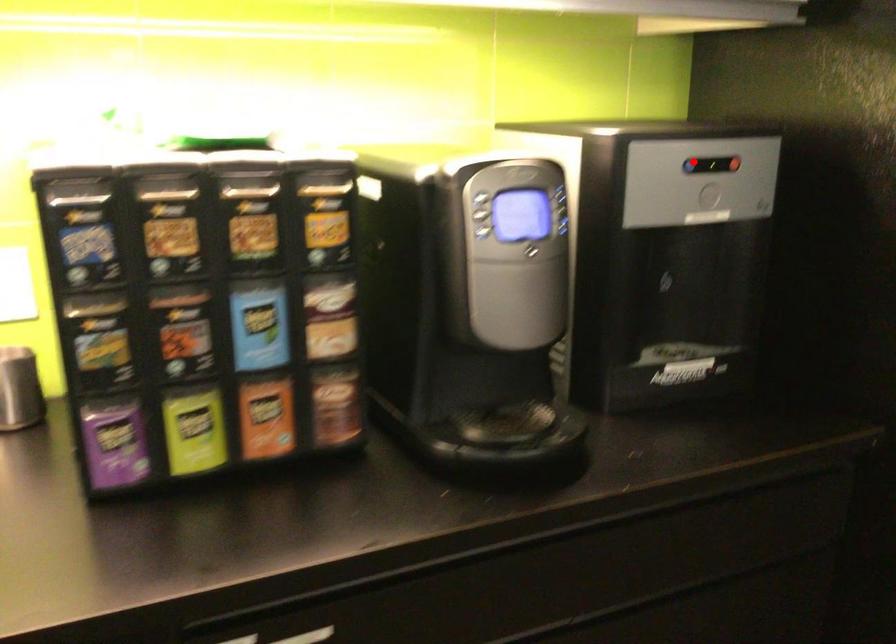
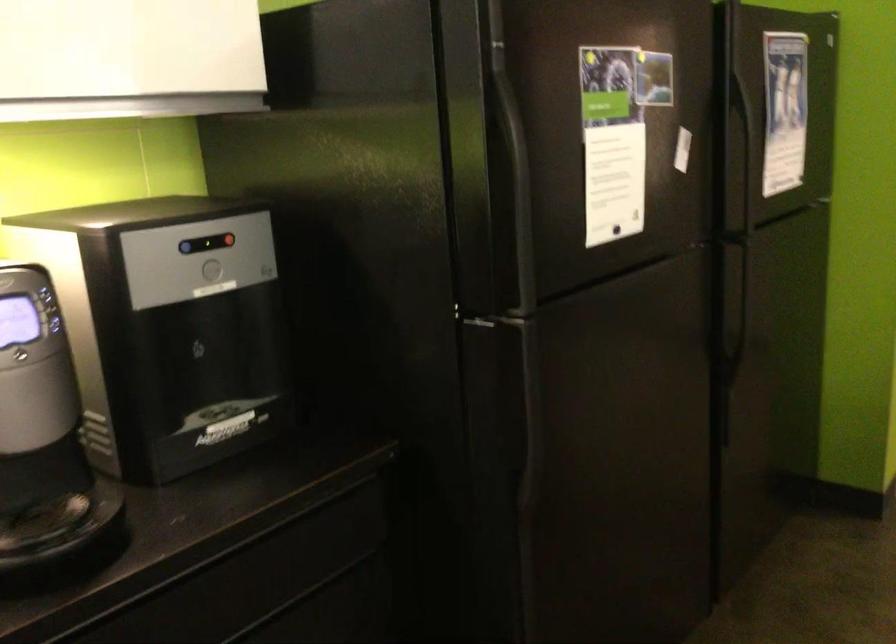
Question: I am providing you with two images of the same scene from different viewpoints. Image1 has a red point marked. In image2, the corresponding 3D location appears at what relative position? Reply with the corresponding letter.

Choices:
 (A) Closer
 (B) Farther

Answer: (B)